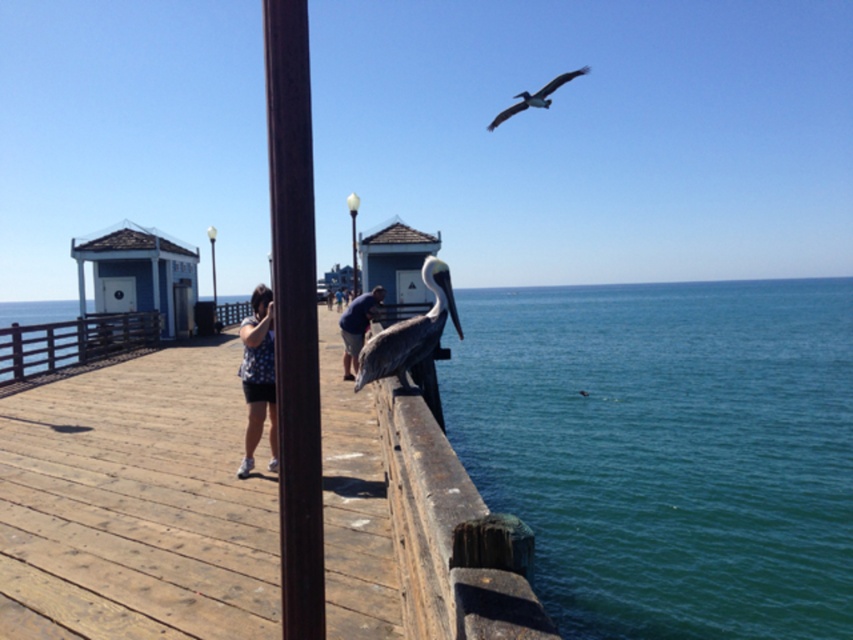
Looking at this image, does blue water at lower right have a smaller size compared to dark blue shirt at center?

Actually, blue water at lower right might be larger than dark blue shirt at center.

Where is `blue water at lower right`? blue water at lower right is located at coordinates (666, 451).

Locate an element on the screen. blue water at lower right is located at coordinates (666, 451).

Where is `brown feathered pelican at center`? The height and width of the screenshot is (640, 853). brown feathered pelican at center is located at coordinates (410, 332).

Between brown feathered pelican at center and brown feathered pelican at upper right, which one is positioned lower?

brown feathered pelican at center

Locate an element on the screen. brown feathered pelican at center is located at coordinates (410, 332).

Between polka dot shirt at center and dark blue shirt at center, which one has less height?

Standing shorter between the two is polka dot shirt at center.

Can you confirm if polka dot shirt at center is taller than dark blue shirt at center?

No, polka dot shirt at center is not taller than dark blue shirt at center.

Identify the location of polka dot shirt at center. The image size is (853, 640). (258, 378).